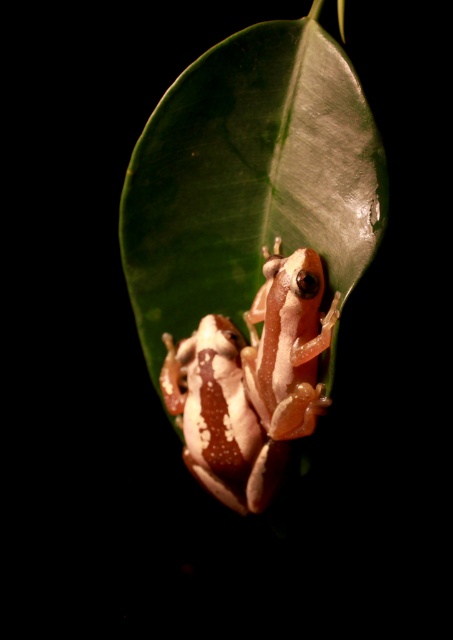
You are a photographer trying to capture both frogs in a single shot. Your camera has a maximum focus range of 10 centimeters. Can you focus on both the translucent skin frog at center and the speckled white frog at center simultaneously?

The distance between the translucent skin frog at center and the speckled white frog at center is 11.13 centimeters, which exceeds the camera maximum focus range of 10 centimeters. Therefore, you cannot focus on both frogs at the same time.

You are an entomologist observing the image. You need to determine which object is taller between the green glossy leaf at center and the speckled white frog at center. Based on the scene, which one is taller?

The green glossy leaf at center is taller than the speckled white frog at center according to the description.

You are an entomologist observing the image. You need to determine which object occupies more space in the frame. Which is larger in size between the green glossy leaf at center and the translucent skin frog at center?

The green glossy leaf at center is larger in size than the translucent skin frog at center, so the leaf occupies more space in the frame.